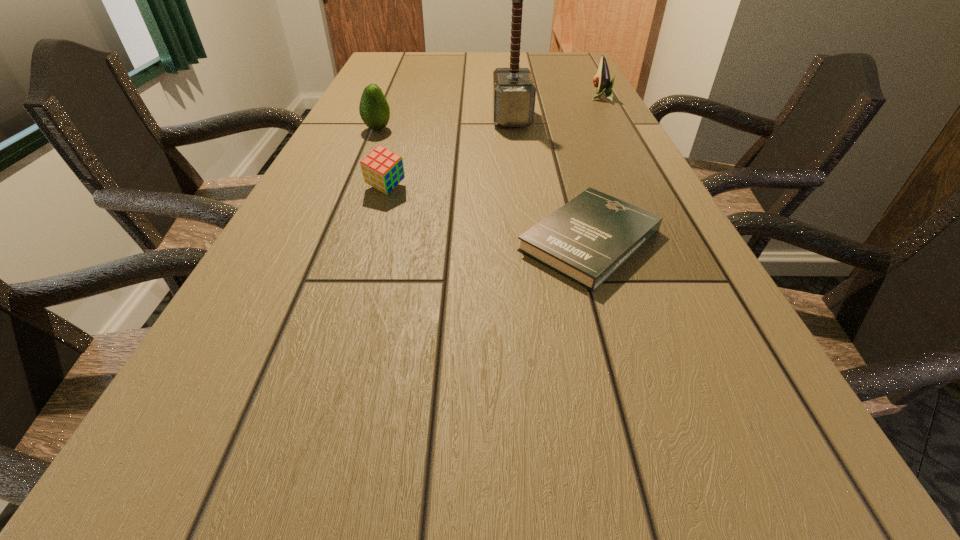
Image resolution: width=960 pixels, height=540 pixels. I want to click on free space located 0.050m on the back of the left avocado, so click(383, 116).

You are a GUI agent. You are given a task and a screenshot of the screen. Output one action in this format:
    pyautogui.click(x=<x>, y=<y>)
    Task: Click on the vacant space located 0.230m on the back of the fourth tallest object
    
    Given the screenshot: What is the action you would take?
    pyautogui.click(x=403, y=132)

Locate an element on the screen. This screenshot has width=960, height=540. vacant space situated 0.320m on the left of the book is located at coordinates (339, 240).

I want to click on avocado that is positioned at the left edge, so click(374, 110).

Find the location of a particular element. cube that is positioned at the left edge is located at coordinates (382, 169).

Find the location of a particular element. The width and height of the screenshot is (960, 540). avocado located at the right edge is located at coordinates (602, 82).

This screenshot has height=540, width=960. Find the location of `book that is at the right edge`. book that is at the right edge is located at coordinates (586, 240).

Find the location of `vacant space at the far edge`. vacant space at the far edge is located at coordinates (487, 59).

Where is `vacant space at the left edge of the desktop`? The image size is (960, 540). vacant space at the left edge of the desktop is located at coordinates (344, 143).

Image resolution: width=960 pixels, height=540 pixels. Identify the location of free space at the right edge of the desktop. (569, 111).